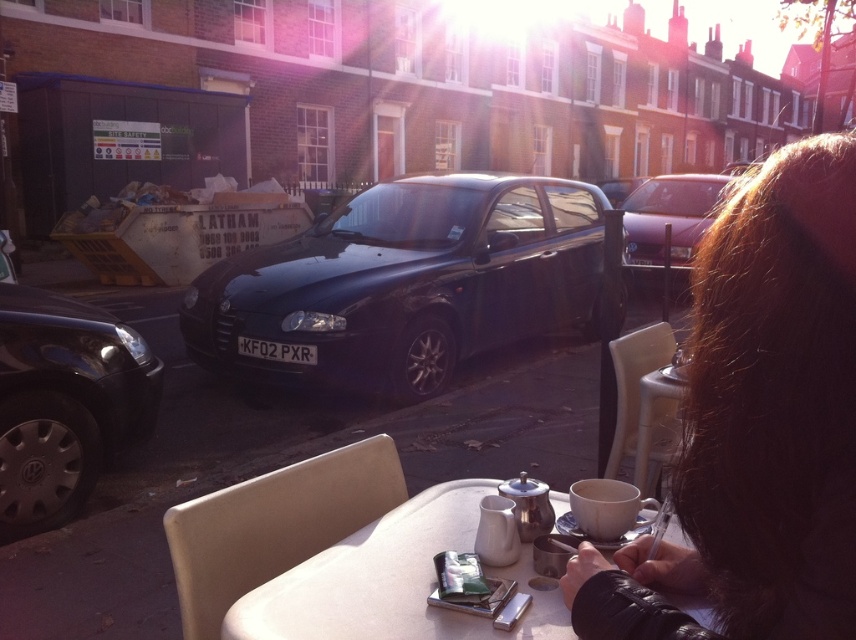
Question: Which of these objects is positioned farthest from the glossy black car at center?

Choices:
 (A) metallic silver table at lower center
 (B) black plastic license plate at center

Answer: (A)

Question: Can you confirm if dark brown hair at upper right is positioned above metallic silver table at lower center?

Choices:
 (A) no
 (B) yes

Answer: (B)

Question: In this image, where is metallic silver table at lower center located relative to metallic purple car at center?

Choices:
 (A) below
 (B) above

Answer: (A)

Question: Can you confirm if dark brown hair at upper right is positioned to the right of metallic silver table at lower center?

Choices:
 (A) yes
 (B) no

Answer: (A)

Question: Among these points, which one is nearest to the camera?

Choices:
 (A) (829, 268)
 (B) (242, 337)
 (C) (9, 364)

Answer: (A)

Question: Which object appears closest to the camera in this image?

Choices:
 (A) glossy black car at center
 (B) metallic silver table at lower center
 (C) metallic purple car at center

Answer: (B)